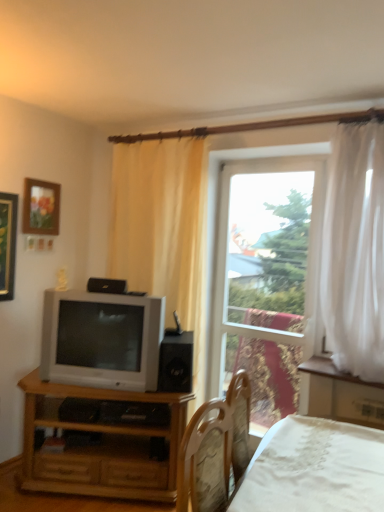
Question: Is light brown wood tv stand at lower left inside the boundaries of black matte speaker at center, or outside?

Choices:
 (A) inside
 (B) outside

Answer: (B)

Question: From the image's perspective, is light brown wood tv stand at lower left above or below black matte speaker at center?

Choices:
 (A) above
 (B) below

Answer: (B)

Question: Which of these objects is positioned farthest from the white sheer curtain at right?

Choices:
 (A) matte silver television at left
 (B) transparent glass window at center
 (C) black matte speaker at center
 (D) wooden framed picture at upper left
 (E) white lace bed at lower right

Answer: (D)

Question: Which is nearer to the white lace bed at lower right?

Choices:
 (A) matte silver television at left
 (B) black matte speaker at center
 (C) white sheer curtain at right
 (D) transparent glass window at center
 (E) light brown wood tv stand at lower left

Answer: (C)